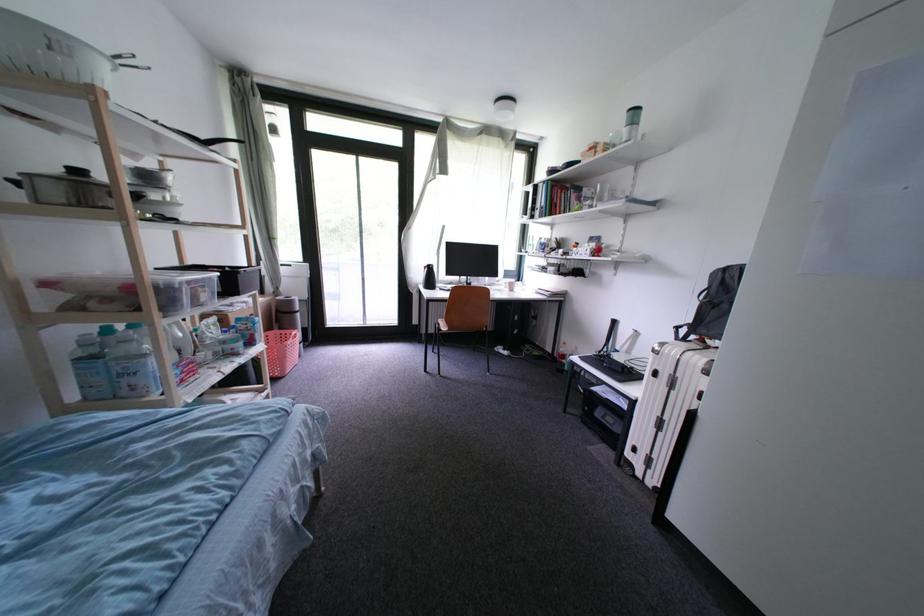
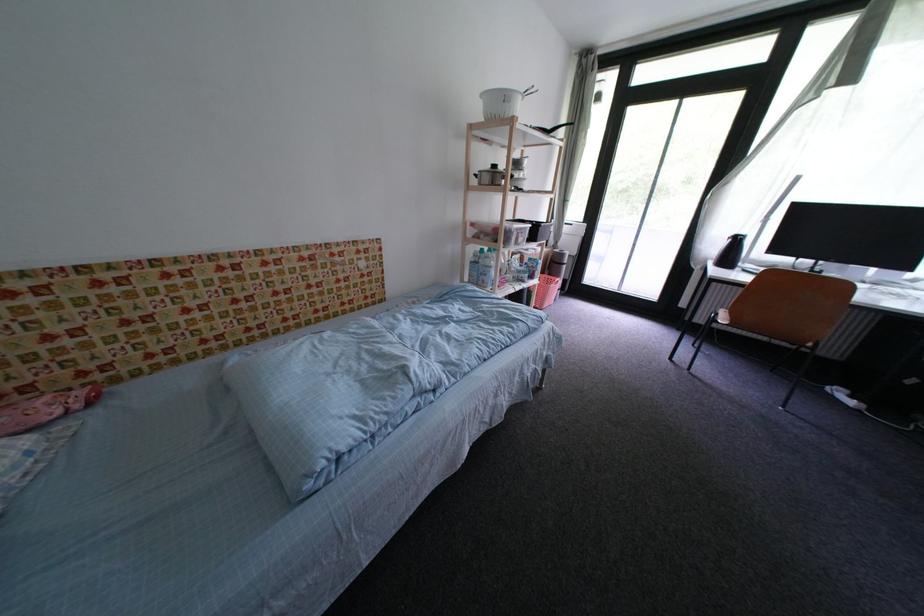
Where in the second image is the point corresponding to pixel 127 329 from the first image?

(493, 252)